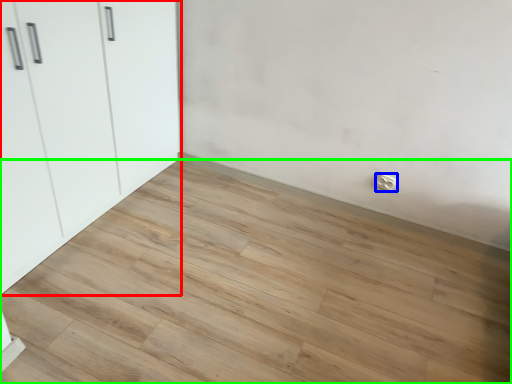
Question: Which object is the closest to the cupboard (highlighted by a red box)? Choose among these: electric outlet (highlighted by a blue box) or plank (highlighted by a green box).

Choices:
 (A) electric outlet
 (B) plank

Answer: (B)